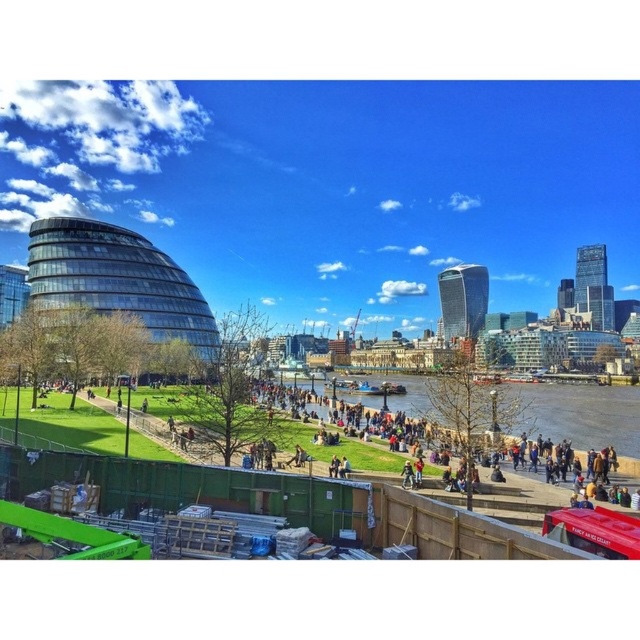
You are a delivery person needing to cross from the construction site to the other side of the river. The path along the paved walkway is blocked by a fallen tree. Can you reach the brown water at center from the green grass at lower center without crossing the river?

The green grass at lower center is to the left of brown water at center, so yes, you can reach the brown water at center from the green grass at lower center by moving to the right since they are adjacent on the same side of the river.

You are a landscape architect designing a new park. You have to place a 30 meter long walkway between the green grass at lower center and the brown water at center. Is the distance sufficient?

The distance between the green grass at lower center and the brown water at center is 28.49 meters. Since the walkway is 30 meters long, the distance is insufficient as it is shorter than the required length.

You are a landscape architect designing a new park. You need to determine the best location to place a new water feature. Based on the scene, which area would be more suitable for the water feature, the green grass at lower center or the brown water at center?

The brown water at center is already present and likely a natural or existing water body, making it the more suitable location for the water feature. The green grass at lower center is in front of the brown water, indicating it might be a grassy area closer to the viewer, but placing a new water feature there could disrupt the existing landscape layout.